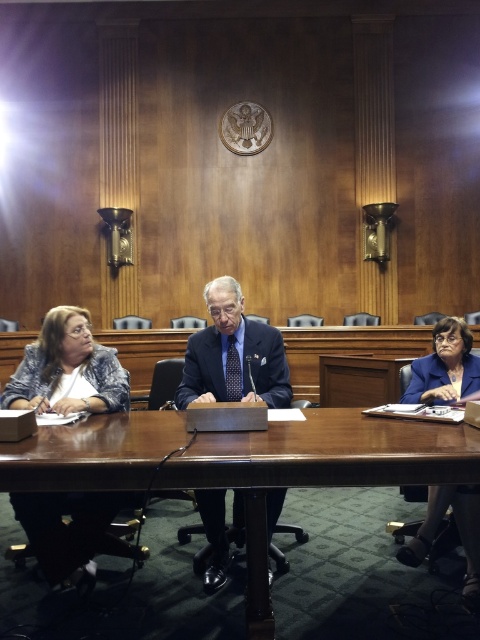
Can you confirm if brown wood table at center is shorter than dark blue fabric suit at center?

Incorrect, brown wood table at center's height does not fall short of dark blue fabric suit at center's.

Identify the location of brown wood table at center. (339, 445).

The image size is (480, 640). I want to click on brown wood table at center, so click(339, 445).

Is point (84, 460) positioned after point (90, 353)?

No, it is in front of (90, 353).

Can you confirm if brown wood table at center is positioned below blue textured blazer at left?

Indeed, brown wood table at center is positioned under blue textured blazer at left.

What do you see at coordinates (339, 445) in the screenshot?
I see `brown wood table at center` at bounding box center [339, 445].

Identify the location of brown wood table at center. Image resolution: width=480 pixels, height=640 pixels. (339, 445).

Can you confirm if dark blue fabric suit at center is positioned below blue fabric jacket at lower right?

Actually, dark blue fabric suit at center is above blue fabric jacket at lower right.

Can you confirm if dark blue fabric suit at center is bigger than blue fabric jacket at lower right?

Correct, dark blue fabric suit at center is larger in size than blue fabric jacket at lower right.

The width and height of the screenshot is (480, 640). Describe the element at coordinates (236, 365) in the screenshot. I see `dark blue fabric suit at center` at that location.

At what (x,y) coordinates should I click in order to perform the action: click on dark blue fabric suit at center. Please return your answer as a coordinate pair (x, y). Looking at the image, I should click on (236, 365).